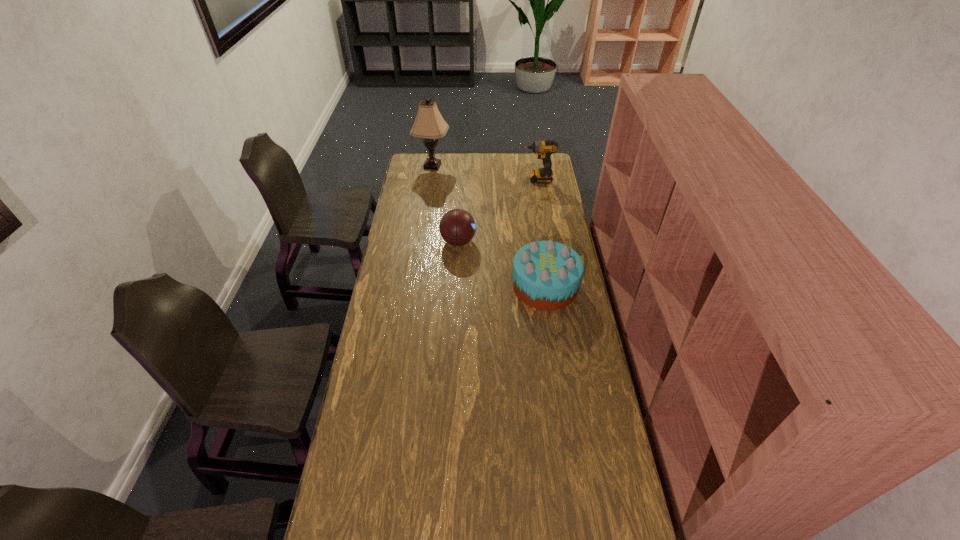
You are a GUI agent. You are given a task and a screenshot of the screen. Output one action in this format:
    pyautogui.click(x=<x>, y=<y>)
    Task: Click on the tallest object
    This screenshot has height=540, width=960.
    Given the screenshot: What is the action you would take?
    pyautogui.click(x=429, y=124)

Identify the location of lamp. The height and width of the screenshot is (540, 960). (429, 124).

Identify the location of the second tallest object. The image size is (960, 540). (544, 149).

Find the location of a particular element. drill is located at coordinates (544, 149).

Find the location of a particular element. the nearest object is located at coordinates (547, 275).

The image size is (960, 540). I want to click on basketball, so click(457, 227).

Find the location of `free space located on the front of the lamp`. free space located on the front of the lamp is located at coordinates (426, 210).

Find the location of a particular element. blank space located 0.260m with the drill bit of the third shortest object facing forward is located at coordinates (474, 180).

Identify the location of free space located 0.370m with the drill bit of the third shortest object facing forward. (455, 180).

Where is `free space located with the drill bit of the third shortest object facing forward`? This screenshot has width=960, height=540. free space located with the drill bit of the third shortest object facing forward is located at coordinates (453, 180).